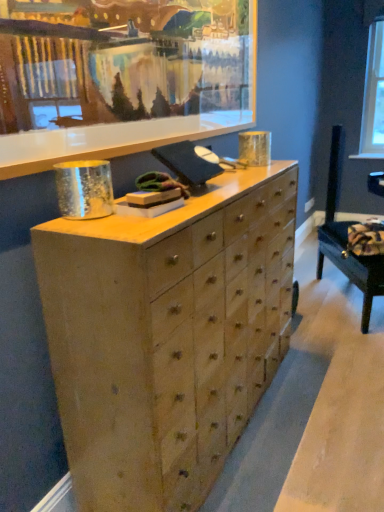
Question: From a real-world perspective, is clear glass window screen at upper right on velvet dark blue swivel chair at lower right?

Choices:
 (A) yes
 (B) no

Answer: (A)

Question: Is clear glass window screen at upper right to the right of velvet dark blue swivel chair at lower right from the viewer's perspective?

Choices:
 (A) yes
 (B) no

Answer: (A)

Question: From the image's perspective, is clear glass window screen at upper right above velvet dark blue swivel chair at lower right?

Choices:
 (A) yes
 (B) no

Answer: (A)

Question: Is clear glass window screen at upper right facing away from velvet dark blue swivel chair at lower right?

Choices:
 (A) yes
 (B) no

Answer: (B)

Question: Would you consider clear glass window screen at upper right to be distant from velvet dark blue swivel chair at lower right?

Choices:
 (A) no
 (B) yes

Answer: (B)

Question: Would you say velvet dark blue swivel chair at lower right is inside or outside clear glass window screen at upper right?

Choices:
 (A) outside
 (B) inside

Answer: (A)

Question: Visually, is velvet dark blue swivel chair at lower right positioned to the left or to the right of clear glass window screen at upper right?

Choices:
 (A) right
 (B) left

Answer: (B)

Question: Is point (362, 271) positioned closer to the camera than point (375, 138)?

Choices:
 (A) closer
 (B) farther

Answer: (A)

Question: Looking at their shapes, would you say velvet dark blue swivel chair at lower right is wider or thinner than clear glass window screen at upper right?

Choices:
 (A) thin
 (B) wide

Answer: (B)

Question: From a real-world perspective, is wooden picture frame at upper center physically located above or below clear glass window screen at upper right?

Choices:
 (A) below
 (B) above

Answer: (B)

Question: In terms of height, does wooden picture frame at upper center look taller or shorter compared to clear glass window screen at upper right?

Choices:
 (A) short
 (B) tall

Answer: (A)

Question: Is wooden picture frame at upper center bigger or smaller than clear glass window screen at upper right?

Choices:
 (A) small
 (B) big

Answer: (B)

Question: Considering their positions, is wooden picture frame at upper center located in front of or behind clear glass window screen at upper right?

Choices:
 (A) front
 (B) behind

Answer: (A)

Question: Relative to wooden picture frame at upper center, is natural wood chest of drawers at center in front or behind?

Choices:
 (A) front
 (B) behind

Answer: (B)

Question: Is natural wood chest of drawers at center spatially inside wooden picture frame at upper center, or outside of it?

Choices:
 (A) outside
 (B) inside

Answer: (A)